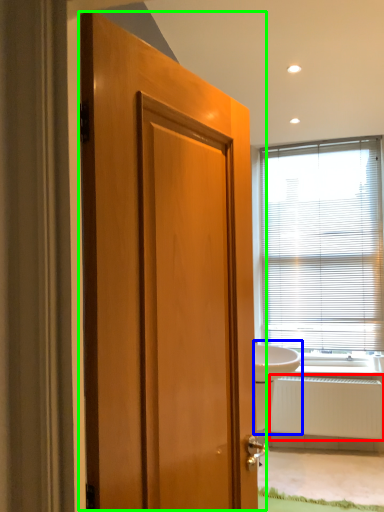
Question: Which object is the closest to the radiator (highlighted by a red box)? Choose among these: sink (highlighted by a blue box) or door (highlighted by a green box).

Choices:
 (A) sink
 (B) door

Answer: (A)